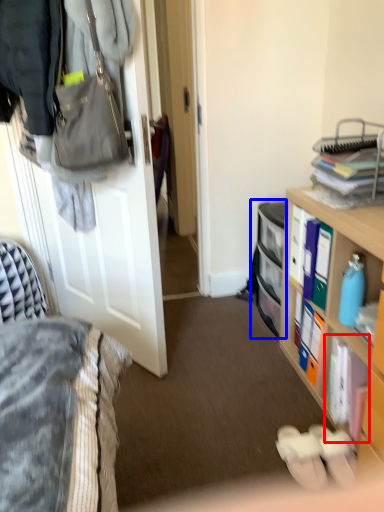
Question: Which object is closer to the camera taking this photo, book (highlighted by a red box) or cabinet (highlighted by a blue box)?

Choices:
 (A) book
 (B) cabinet

Answer: (A)